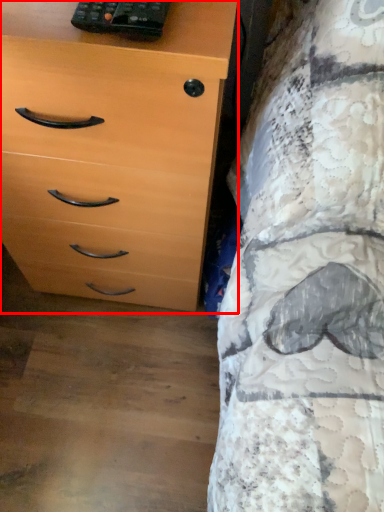
Question: From the image's perspective, where is chest of drawers (annotated by the red box) located relative to control?

Choices:
 (A) above
 (B) below

Answer: (B)